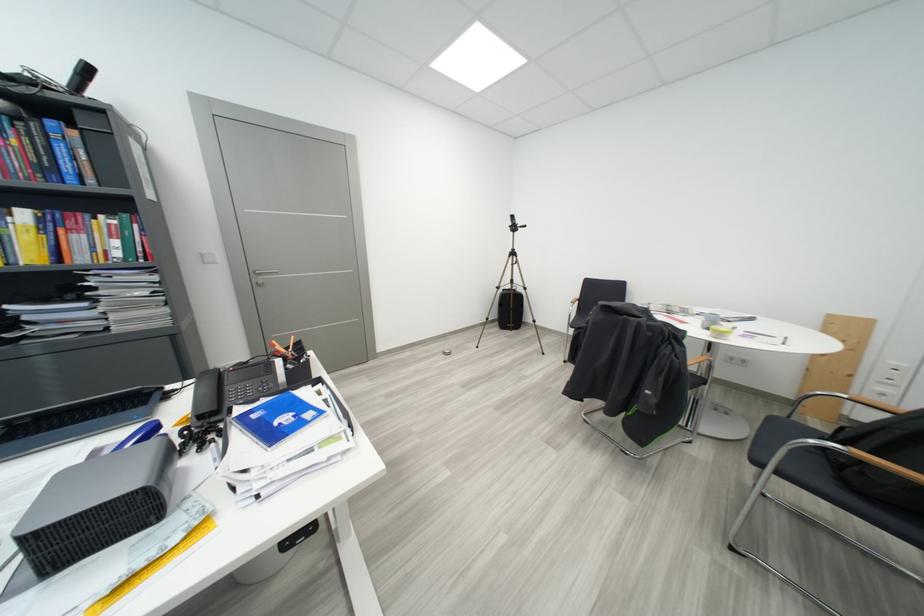
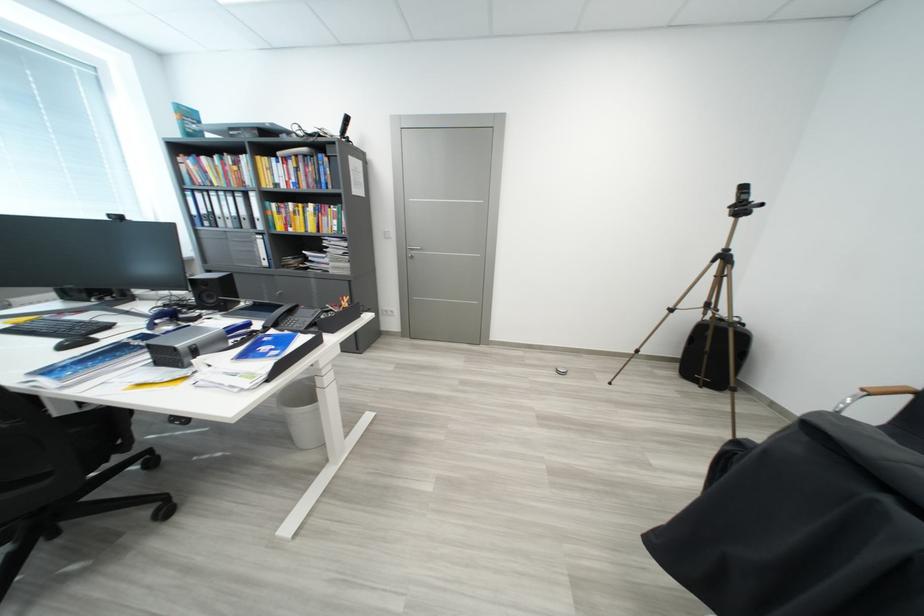
Find the pixel in the second image that matches point (505, 331) in the first image.

(684, 377)